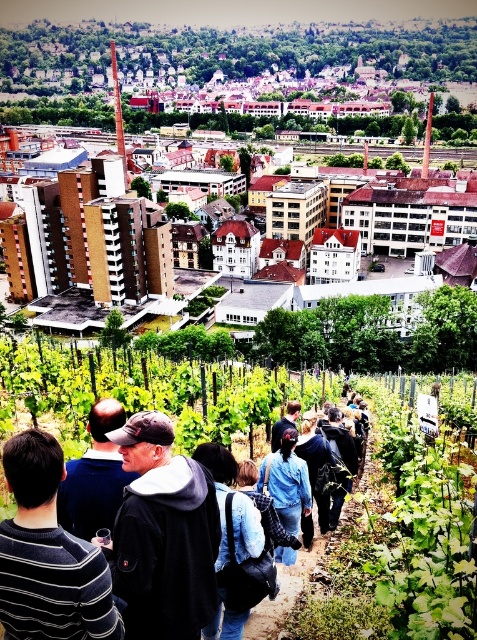
You are a photographer standing at the edge of the vineyard path. You want to take a photo of the black hoodie at center and denim jacket at center so that both are clearly visible. Which clothing item should you focus on first to ensure it appears sharp in the photo?

The black hoodie at center is bigger than the denim jacket at center, so you should focus on the black hoodie at center first to ensure it appears sharp in the photo.

You are standing in the vineyard and want to reach the point marked at coordinates (152, 484). The path through the grapevines is 1.2 meters wide. Your backpack is 1.5 meters wide. Can you walk through the path with your backpack on?

The path through the grapevines is 1.2 meters wide, and your backpack is 1.5 meters wide. Since the backpack is wider than the path, you cannot walk through the path with your backpack on.